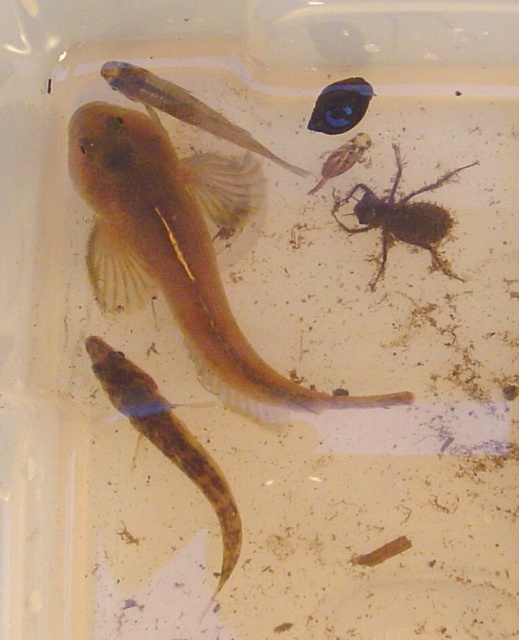
I want to click on brown fuzzy insect at upper right, so click(x=402, y=218).

Can you confirm if brown fuzzy insect at upper right is positioned below translucent brown insect at upper center?

Indeed, brown fuzzy insect at upper right is positioned under translucent brown insect at upper center.

Is point (383, 252) positioned before point (313, 193)?

No, (383, 252) is behind (313, 193).

What are the coordinates of `brown fuzzy insect at upper right` in the screenshot? It's located at [x=402, y=218].

Is translucent gelatinous fish at bottom left to the left of translucent gelatinous fish at upper center from the viewer's perspective?

Indeed, translucent gelatinous fish at bottom left is positioned on the left side of translucent gelatinous fish at upper center.

In order to click on translucent gelatinous fish at bottom left in this screenshot , I will do `click(168, 438)`.

Is translucent gelatinous fish at upper center to the right of glossy black fish at upper center from the viewer's perspective?

No, translucent gelatinous fish at upper center is not to the right of glossy black fish at upper center.

Who is more distant from viewer, (121, 74) or (327, 104)?

The point (327, 104) is behind.

Where is `translucent gelatinous fish at upper center`? translucent gelatinous fish at upper center is located at coordinates (183, 106).

Find the location of a particular element. translucent gelatinous fish at upper center is located at coordinates (183, 106).